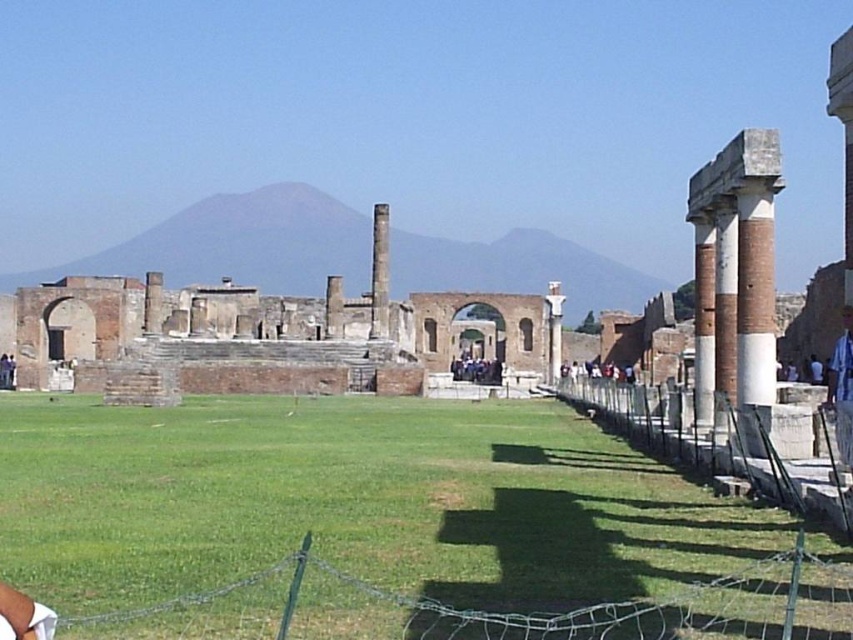
Does green wire mesh at lower center have a smaller size compared to white stone fence at right?

Indeed, green wire mesh at lower center has a smaller size compared to white stone fence at right.

You are a GUI agent. You are given a task and a screenshot of the screen. Output one action in this format:
    pyautogui.click(x=<x>, y=<y>)
    Task: Click on the green wire mesh at lower center
    The height and width of the screenshot is (640, 853).
    Given the screenshot: What is the action you would take?
    pyautogui.click(x=491, y=611)

Which is behind, point (759, 234) or point (601, 381)?

The point (601, 381) is behind.

Does red brick column at right appear over white stone fence at right?

Yes, red brick column at right is above white stone fence at right.

Which is behind, point (769, 234) or point (579, 388)?

Point (579, 388)

You are a GUI agent. You are given a task and a screenshot of the screen. Output one action in this format:
    pyautogui.click(x=<x>, y=<y>)
    Task: Click on the red brick column at right
    Image resolution: width=853 pixels, height=640 pixels.
    Given the screenshot: What is the action you would take?
    pyautogui.click(x=738, y=262)

Does light blue fabric shirt at right have a larger size compared to dark gray stone people at center?

Yes.

Is light blue fabric shirt at right wider than dark gray stone people at center?

Yes.

Between point (837, 388) and point (495, 358), which one is positioned behind?

Positioned behind is point (495, 358).

The image size is (853, 640). In order to click on light blue fabric shirt at right in this screenshot , I will do `click(842, 390)`.